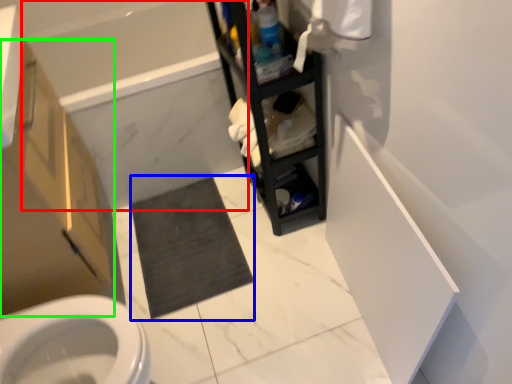
Question: Which object is the farthest from bath (highlighted by a red box)? Choose among these: bath mat (highlighted by a blue box) or bathroom cabinet (highlighted by a green box).

Choices:
 (A) bath mat
 (B) bathroom cabinet

Answer: (B)